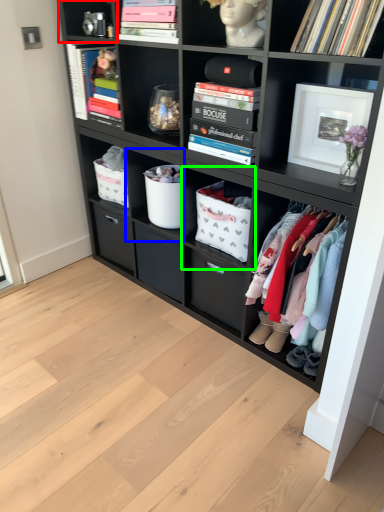
Question: Which object is the closest to the cabinet (highlighted by a red box)? Choose among these: shelf (highlighted by a blue box) or shelf (highlighted by a green box).

Choices:
 (A) shelf
 (B) shelf

Answer: (A)